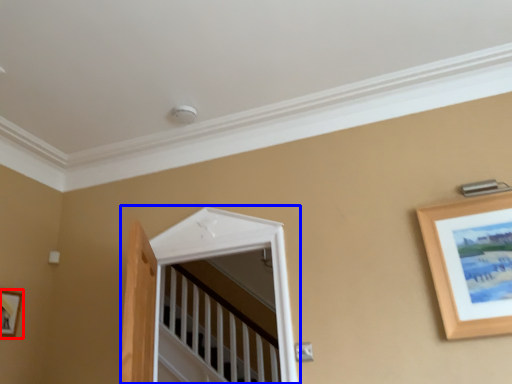
Question: Which object is further to the camera taking this photo, picture frame (highlighted by a red box) or window (highlighted by a blue box)?

Choices:
 (A) picture frame
 (B) window

Answer: (A)